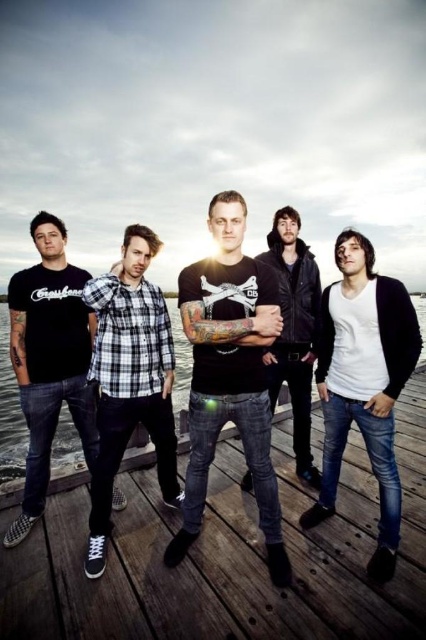
Is point (229, 244) farther from viewer compared to point (11, 477)?

No, (229, 244) is closer to viewer.

Measure the distance from black matte t-shirt at center to transparent water at center.

The distance of black matte t-shirt at center from transparent water at center is 32.08 feet.

I want to click on black matte t-shirt at center, so click(x=230, y=374).

Which of these two, black matte t-shirt at center or white checkered shirt at center, stands taller?

black matte t-shirt at center is taller.

Who is more distant from viewer, (339, 384) or (135, 419)?

Point (135, 419)

Identify the location of black matte t-shirt at center. The height and width of the screenshot is (640, 426). coord(230,374).

Image resolution: width=426 pixels, height=640 pixels. Identify the location of white matte sweater at center. (363, 381).

This screenshot has height=640, width=426. Describe the element at coordinates (363, 381) in the screenshot. I see `white matte sweater at center` at that location.

Find the location of a particular element. The width and height of the screenshot is (426, 640). white matte sweater at center is located at coordinates (363, 381).